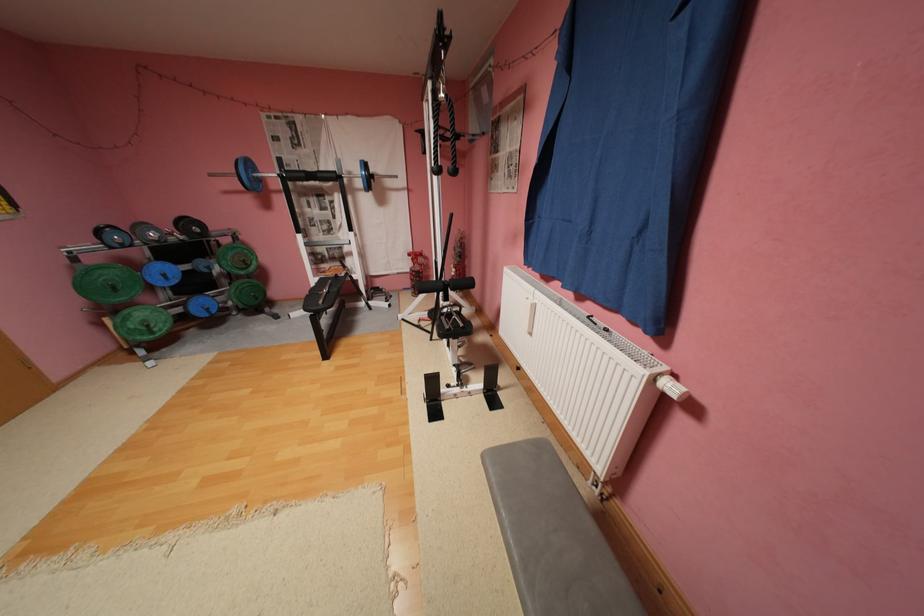
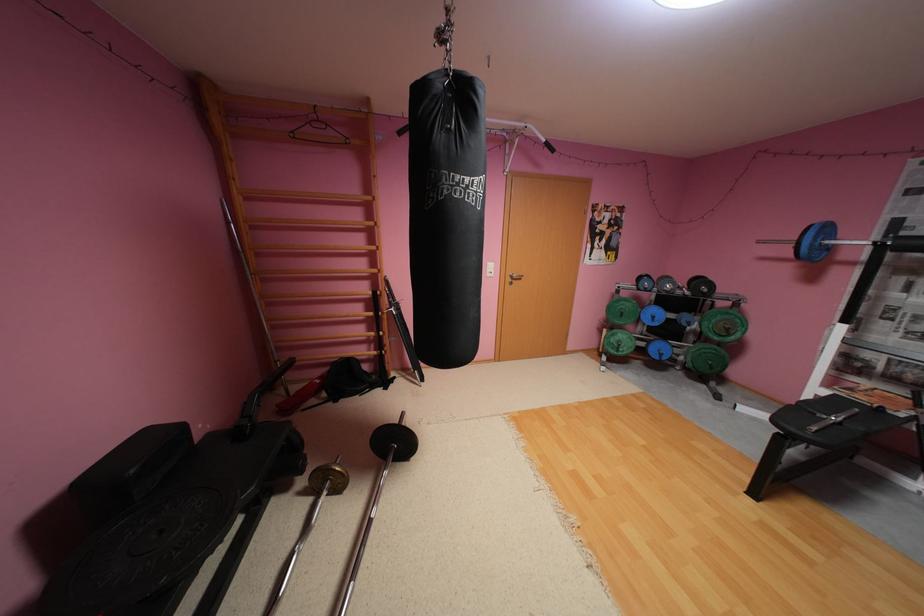
Find the pixel in the second image that matches point (162, 333) in the first image.

(626, 351)